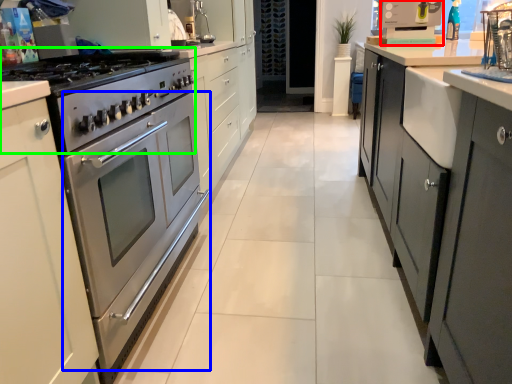
Question: Considering the real-world distances, which object is farthest from appliance (highlighted by a red box)? oven (highlighted by a blue box) or gas stove (highlighted by a green box)?

Choices:
 (A) oven
 (B) gas stove

Answer: (A)